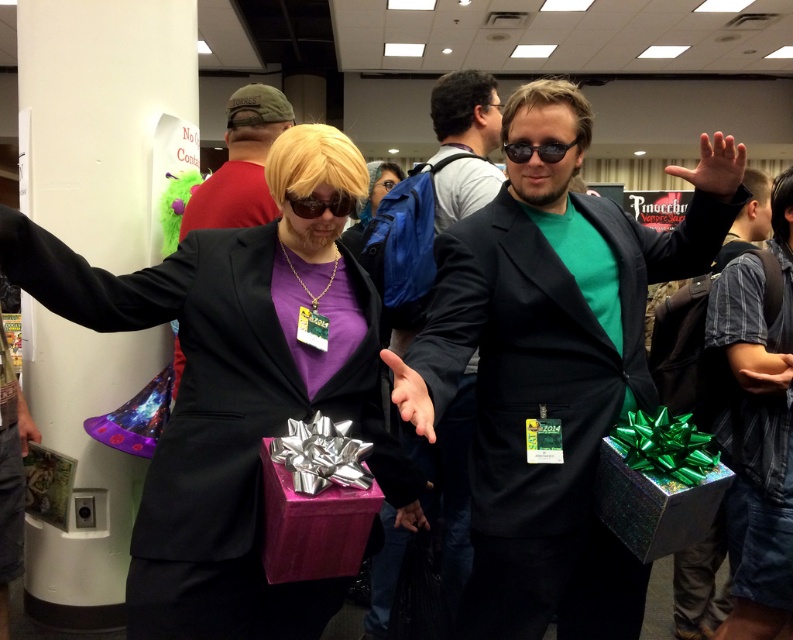
Question: Which object is positioned closest to the green matte jacket at center?

Choices:
 (A) shiny black suit at center
 (B) matte black suit at center
 (C) matte purple gift box at center
 (D) blonde wig at center

Answer: (A)

Question: Which object is closer to the camera taking this photo?

Choices:
 (A) matte black suit at center
 (B) black matte sunglasses at center
 (C) green matte jacket at center

Answer: (C)

Question: Observing the image, what is the correct spatial positioning of matte purple gift box at center in reference to blonde wig at center?

Choices:
 (A) below
 (B) above

Answer: (A)

Question: Estimate the real-world distances between objects in this image. Which object is closer to the matte purple gift box at center?

Choices:
 (A) black reflective sunglasses at center
 (B) shiny black suit at center
 (C) black matte sunglasses at center

Answer: (C)

Question: Does green matte jacket at center appear over black matte sunglasses at center?

Choices:
 (A) yes
 (B) no

Answer: (B)

Question: Where is green matte jacket at center located in relation to black reflective sunglasses at center in the image?

Choices:
 (A) below
 (B) above

Answer: (A)